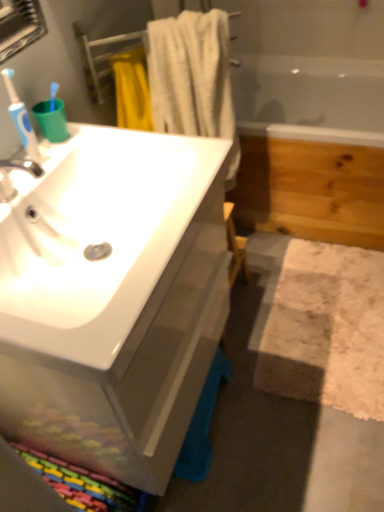
Where is `vacant space to the right of blue plastic toothbrush at left`? vacant space to the right of blue plastic toothbrush at left is located at coordinates (109, 143).